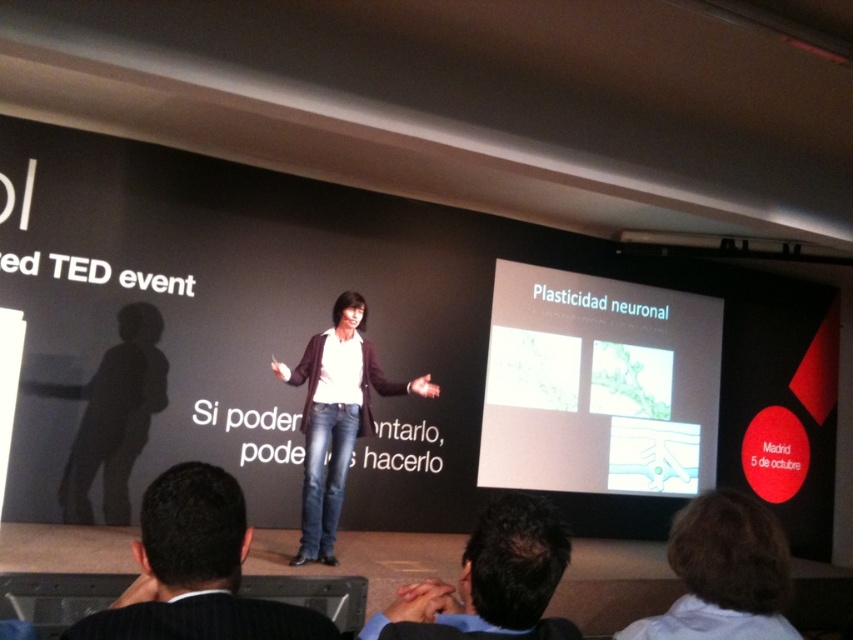
You are an attendee at the TED event. You notice the white paper at center and the dark brown hair at upper right. Which object is bigger in size?

The white paper at center is larger in size than the dark brown hair at upper right.

You are an attendee at the TED event. You see the black suit at lower left and the dark brown hair at upper right. Which object is positioned higher in the image?

The black suit at lower left is above the dark brown hair at upper right, so the black suit at lower left is positioned higher in the image.

You are an attendee at the TED event. You notice the speaker has dark brown hair at upper right and denim jeans at center. Which part of the speaker is higher up in the image?

The dark brown hair at upper right is above denim jeans at center in the image.